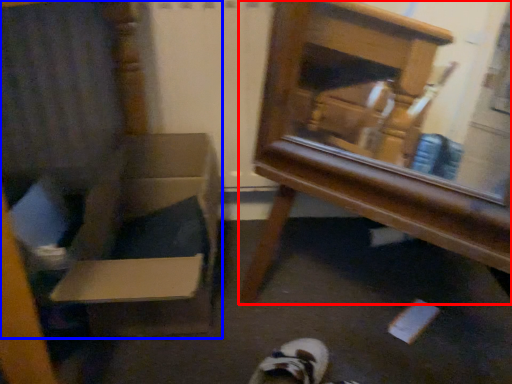
Question: Which of the following is the farthest to the observer, furniture (highlighted by a red box) or armchair (highlighted by a blue box)?

Choices:
 (A) furniture
 (B) armchair

Answer: (A)